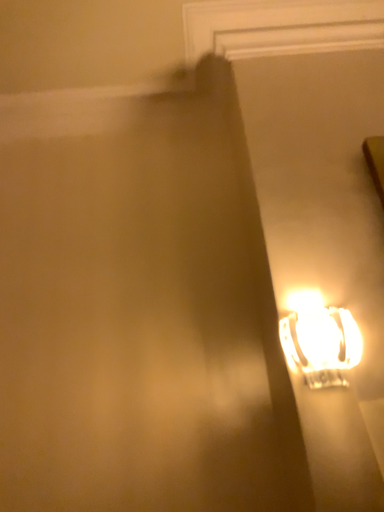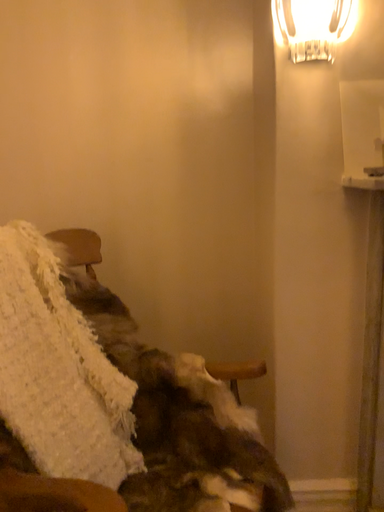
Question: Which way did the camera rotate in the video?

Choices:
 (A) rotated upward
 (B) rotated downward

Answer: (B)